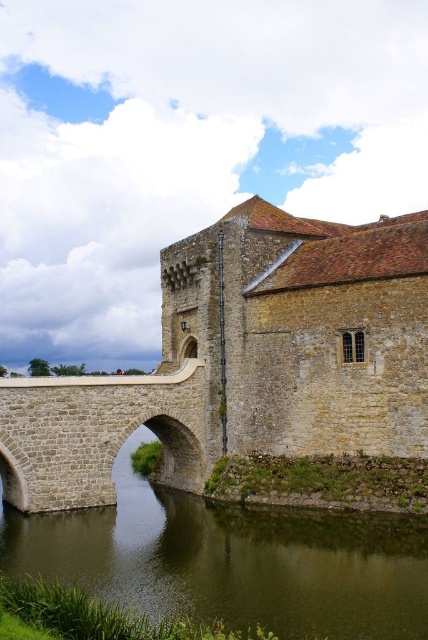
You are standing at point A at coordinates (392, 273). The castle entrance is 146.65 feet away from you. If you walk straight towards the entrance, will you be able to reach it without crossing any water?

The castle entrance is 146.65 feet away from point A at coordinates (392, 273). Since the scene description mentions the castle is beside a body of water but does not specify any water between the point and the entrance, you can reach it by walking straight.